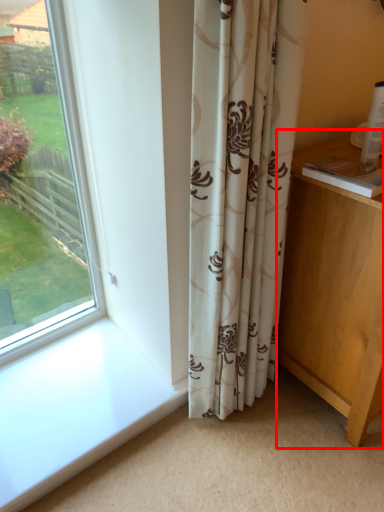
Question: From the image's perspective, where is vanity (annotated by the red box) located in relation to curtain in the image?

Choices:
 (A) above
 (B) below

Answer: (B)